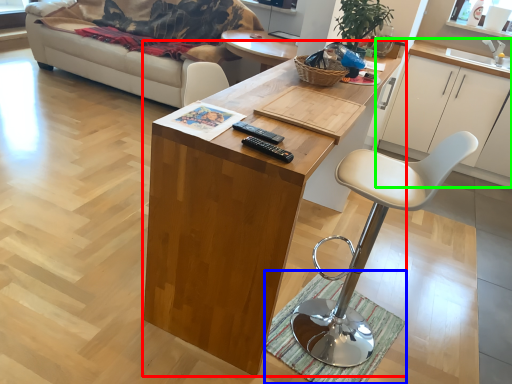
Question: Estimate the real-world distances between objects in this image. Which object is closer to desk (highlighted by a red box), mat (highlighted by a blue box) or cabinetry (highlighted by a green box)?

Choices:
 (A) mat
 (B) cabinetry

Answer: (A)